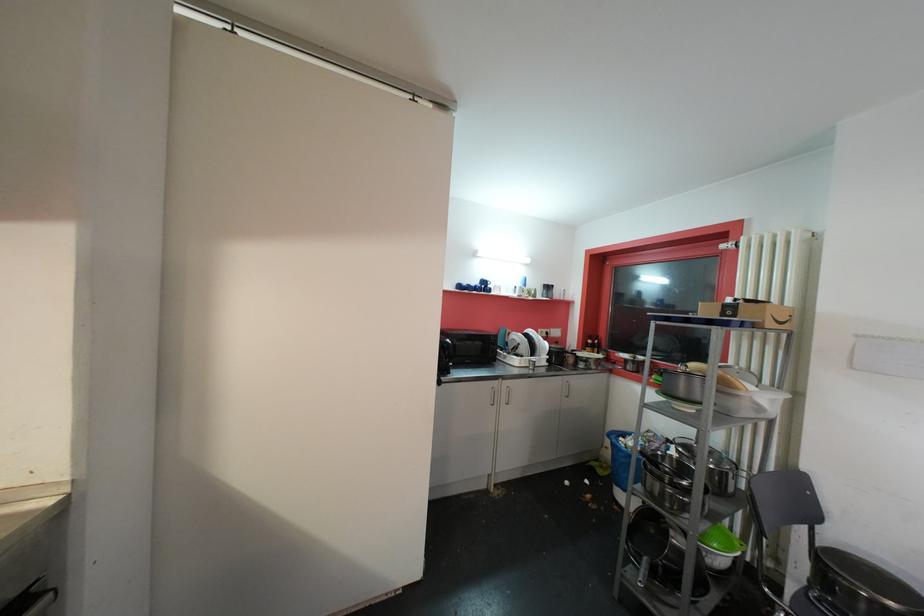
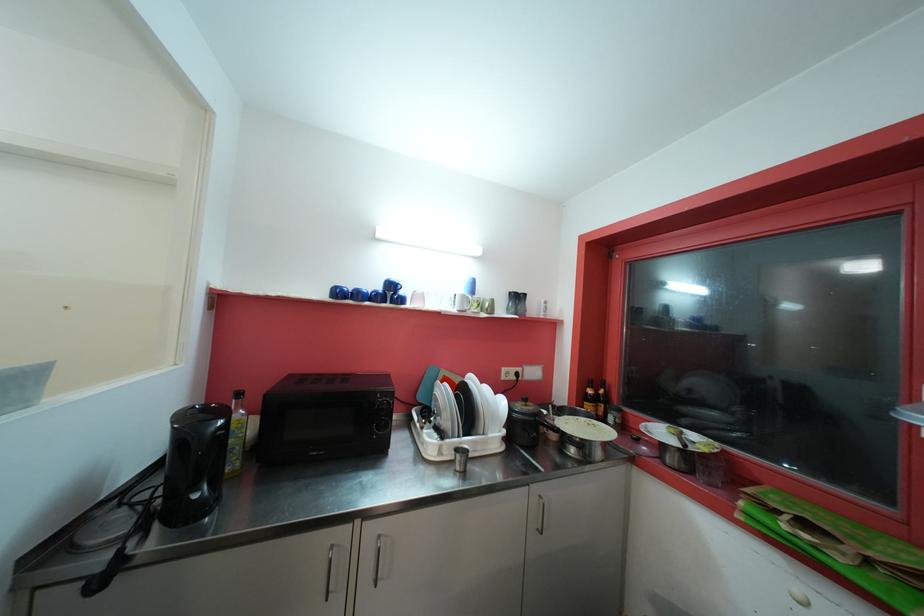
Where in the second image is the point corresponding to (469,286) from the first image?

(354, 290)